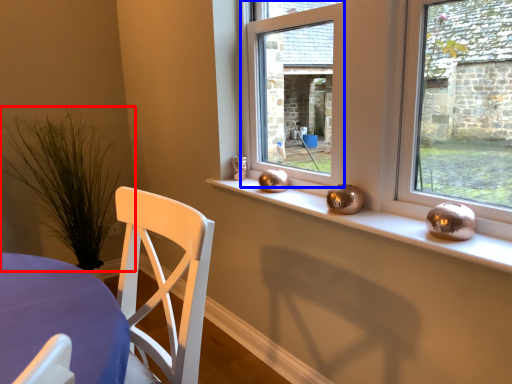
Question: Among these objects, which one is nearest to the camera, plant (highlighted by a red box) or window (highlighted by a blue box)?

Choices:
 (A) plant
 (B) window

Answer: (B)